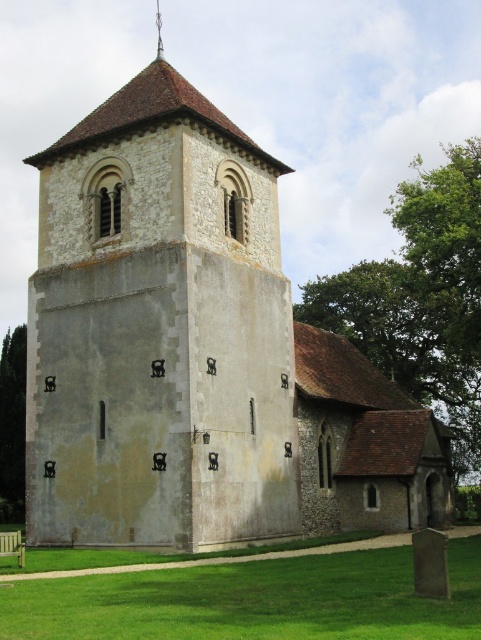
Question: Can you confirm if white stone tower at center is positioned below green grass at lower center?

Choices:
 (A) yes
 (B) no

Answer: (B)

Question: Which point is farther from the camera taking this photo?

Choices:
 (A) (188, 604)
 (B) (283, 461)

Answer: (B)

Question: Is white stone tower at center above green grass at lower center?

Choices:
 (A) no
 (B) yes

Answer: (B)

Question: In this image, where is white stone tower at center located relative to green grass at lower center?

Choices:
 (A) below
 (B) above

Answer: (B)

Question: Which of the following is the closest to the observer?

Choices:
 (A) white stone tower at center
 (B) green grass at lower center

Answer: (B)